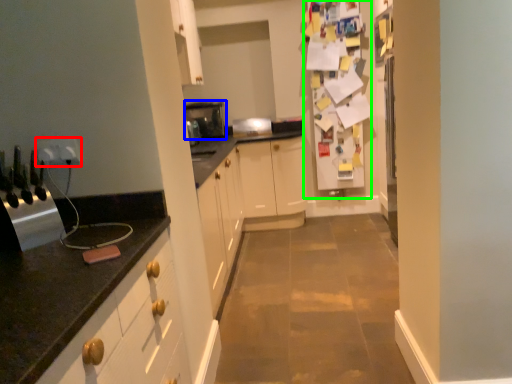
Question: Estimate the real-world distances between objects in this image. Which object is farther from electric outlet (highlighted by a red box), appliance (highlighted by a blue box) or fridge (highlighted by a green box)?

Choices:
 (A) appliance
 (B) fridge

Answer: (B)